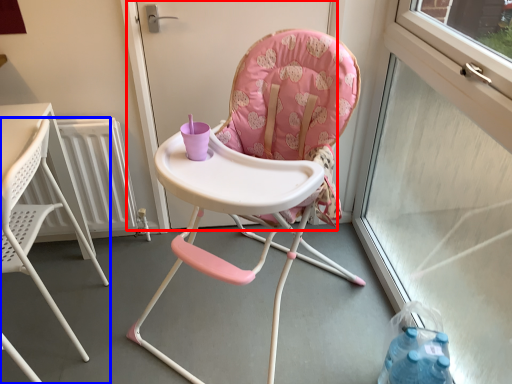
Question: Which object is further to the camera taking this photo, screen door (highlighted by a red box) or chair (highlighted by a blue box)?

Choices:
 (A) screen door
 (B) chair

Answer: (A)